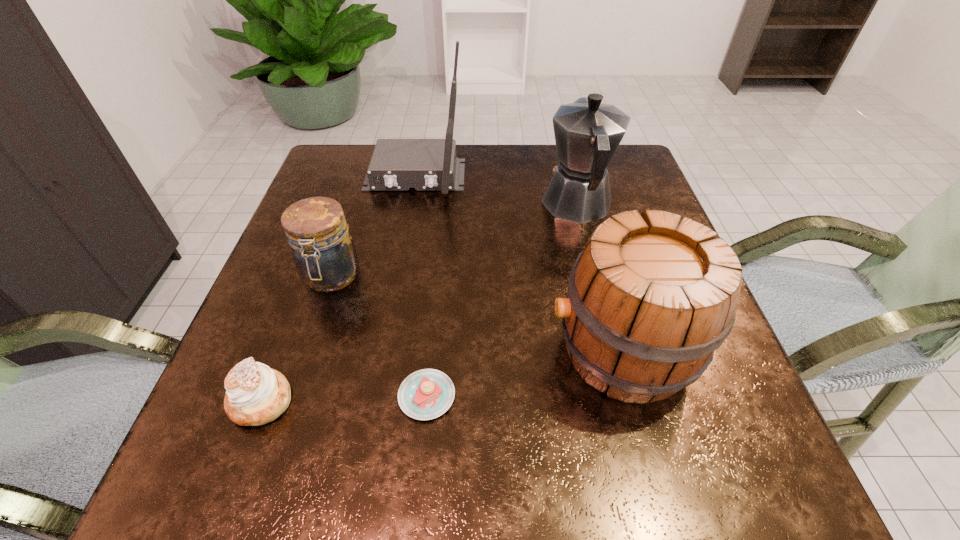
The height and width of the screenshot is (540, 960). Identify the location of router at the left edge. (397, 164).

Find the location of `jar present at the left edge`. jar present at the left edge is located at coordinates (324, 253).

The width and height of the screenshot is (960, 540). Identify the location of pastry located at the left edge. (256, 394).

Identify the location of coffeepot that is at the right edge. Image resolution: width=960 pixels, height=540 pixels. (587, 132).

What are the coordinates of `cider present at the right edge` in the screenshot? It's located at (649, 302).

Locate an element on the screen. object at the far left corner is located at coordinates (397, 164).

The height and width of the screenshot is (540, 960). In order to click on object that is at the far right corner in this screenshot , I will do `click(587, 132)`.

The height and width of the screenshot is (540, 960). I want to click on free space at the far edge of the desktop, so click(x=548, y=151).

In the image, there is a desktop. Identify the location of free space at the near edge. The width and height of the screenshot is (960, 540). (437, 454).

In the image, there is a desktop. Identify the location of vacant space at the left edge. (295, 414).